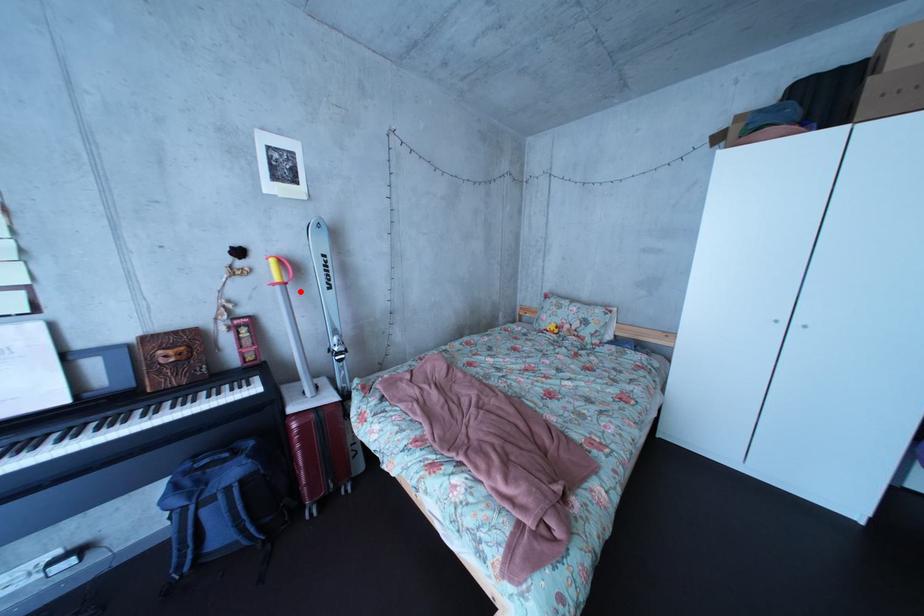
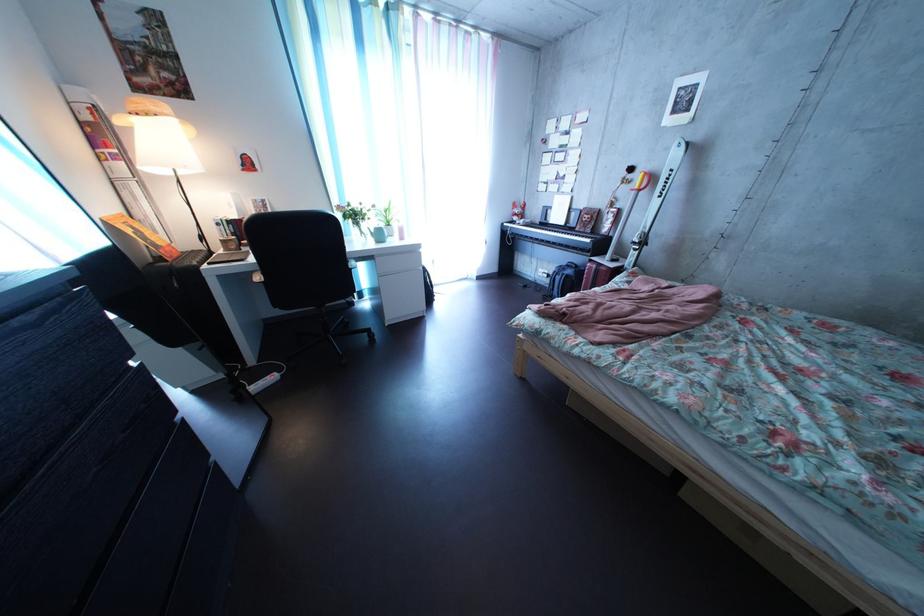
Question: I am providing you with two images of the same scene from different viewpoints. A red point is marked on the first image. Is the red point's position out of view in image 2?

Choices:
 (A) Yes
 (B) No

Answer: (B)